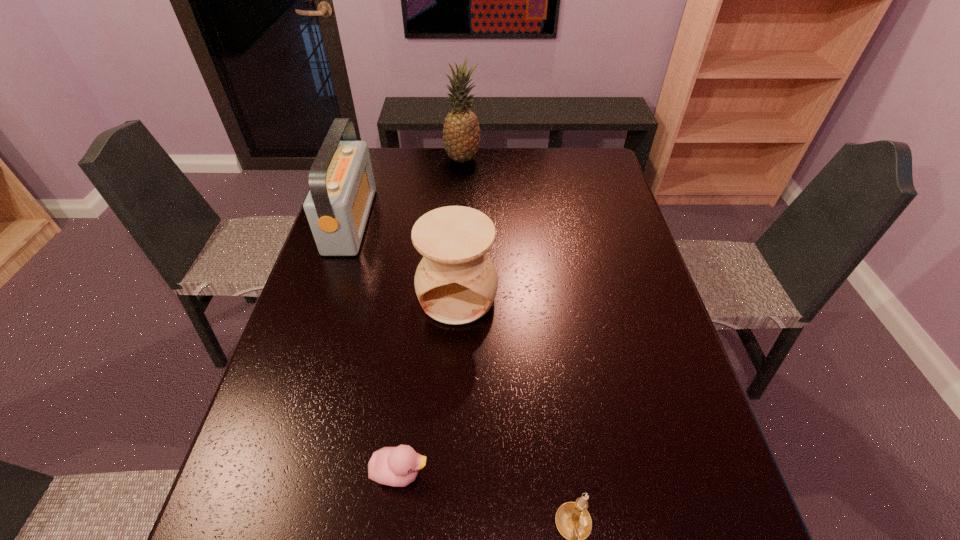
You are a GUI agent. You are given a task and a screenshot of the screen. Output one action in this format:
    pyautogui.click(x=<x>, y=<y>)
    Task: Click on the free space between the fourth shortest object and the pottery
    The width and height of the screenshot is (960, 540).
    Given the screenshot: What is the action you would take?
    pyautogui.click(x=404, y=258)

At what (x,y) coordinates should I click in order to perform the action: click on vacant region between the radio receiver and the pottery. Please return your answer as a coordinate pair (x, y). This screenshot has width=960, height=540. Looking at the image, I should click on (404, 258).

You are a GUI agent. You are given a task and a screenshot of the screen. Output one action in this format:
    pyautogui.click(x=<x>, y=<y>)
    Task: Click on the vacant space that's between the leftmost object and the tallest object
    This screenshot has width=960, height=540.
    Given the screenshot: What is the action you would take?
    pyautogui.click(x=406, y=190)

Locate an element on the screen. This screenshot has height=540, width=960. free space between the third tallest object and the shortest object is located at coordinates (429, 384).

Locate which object is the closest to the nearest object. Please provide its 2D coordinates. Your answer should be formatted as a tuple, i.e. [(x, y)], where the tuple contains the x and y coordinates of a point satisfying the conditions above.

[(398, 466)]

Choose which object is the nearest neighbor to the nearest object. Please provide its 2D coordinates. Your answer should be formatted as a tuple, i.e. [(x, y)], where the tuple contains the x and y coordinates of a point satisfying the conditions above.

[(398, 466)]

The height and width of the screenshot is (540, 960). Identify the location of free space that satisfies the following two spatial constraints: 1. on the front side of the tallest object; 2. on the front-facing side of the shortest object. (446, 472).

You are a GUI agent. You are given a task and a screenshot of the screen. Output one action in this format:
    pyautogui.click(x=<x>, y=<y>)
    Task: Click on the free spot that satisfies the following two spatial constraints: 1. at the open side of the pottery; 2. on the front-facing side of the second nearest object
    
    Given the screenshot: What is the action you would take?
    pyautogui.click(x=449, y=472)

I want to click on free spot that satisfies the following two spatial constraints: 1. on the front side of the tallest object; 2. on the front-facing side of the duckling, so click(x=446, y=472).